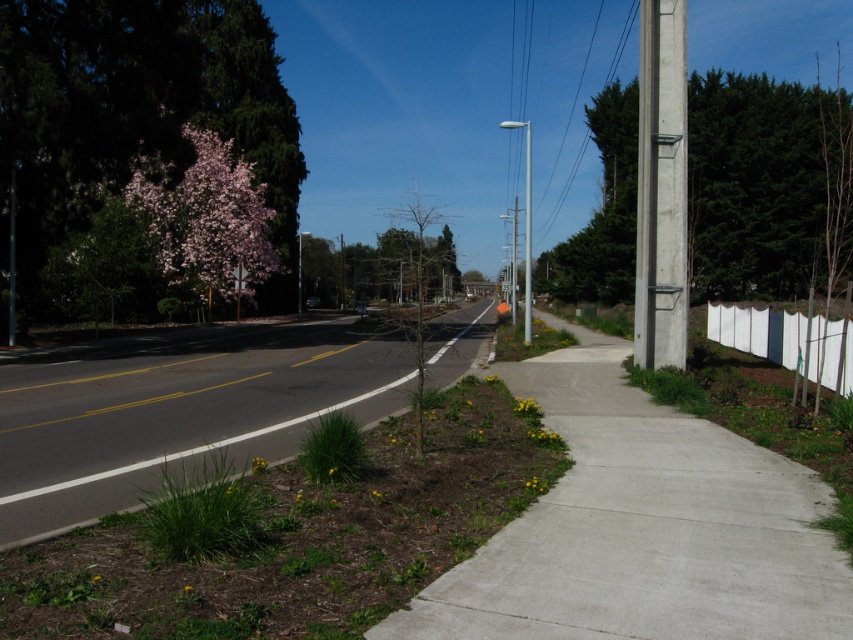
Measure the distance between concrete sidewalk at center and bare wood tree at center.

concrete sidewalk at center and bare wood tree at center are 16.02 meters apart.

Between concrete sidewalk at center and bare wood tree at center, which one has more height?

Standing taller between the two is bare wood tree at center.

Does point (831, 620) lie in front of point (421, 305)?

Yes, it is.

Find the location of a particular element. concrete sidewalk at center is located at coordinates [x=642, y=528].

Is concrete sidewalk at center to the left of white fabric fence at right from the viewer's perspective?

Correct, you'll find concrete sidewalk at center to the left of white fabric fence at right.

Who is more forward, (737,515) or (839,387)?

Point (737,515) is more forward.

Which is in front, point (602, 474) or point (732, 314)?

Point (602, 474) is more forward.

Find the location of a particular element. concrete sidewalk at center is located at coordinates (642, 528).

Looking at this image, does dark asphalt road at lower left appear on the left side of green textured pole at right?

Yes, dark asphalt road at lower left is to the left of green textured pole at right.

You are a GUI agent. You are given a task and a screenshot of the screen. Output one action in this format:
    pyautogui.click(x=<x>, y=<y>)
    Task: Click on the dark asphalt road at lower left
    The width and height of the screenshot is (853, 640).
    Given the screenshot: What is the action you would take?
    pyautogui.click(x=178, y=420)

Between point (233, 436) and point (805, 120), which one is positioned behind?

Point (805, 120)

This screenshot has height=640, width=853. In order to click on dark asphalt road at lower left in this screenshot , I will do `click(178, 420)`.